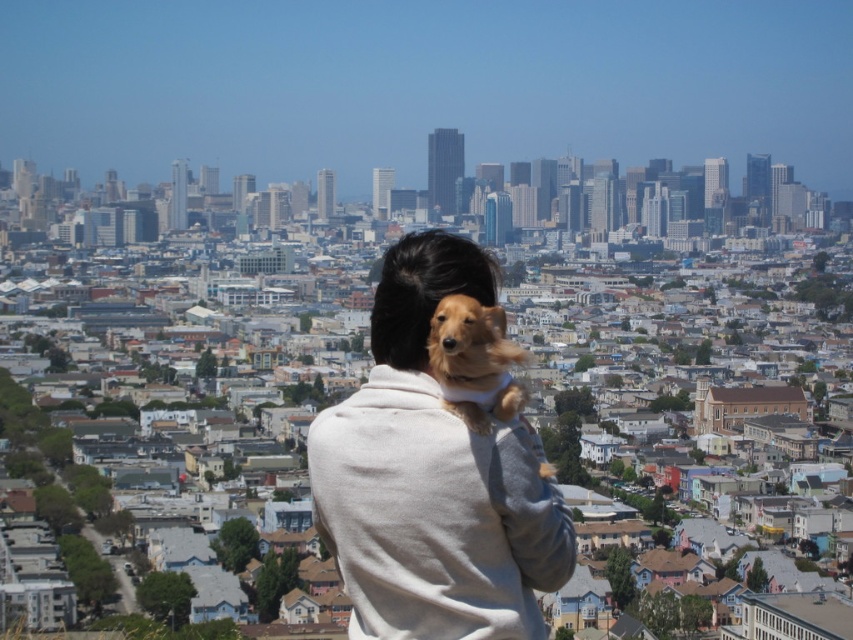
You are a photographer trying to capture the golden fur dog at upper center and the light beige sweater at center in the same frame. Which object should you adjust your camera focus to first to ensure both are in focus?

The light beige sweater at center is in front of the golden fur dog at upper center, so you should focus on the golden fur dog at upper center first to ensure both are in focus.

You are a drone operator tasked with capturing aerial footage of the light beige sweater at center. The drone is currently at the point marked by point (432, 477). To ensure the best shot, you need to adjust the drone to face directly towards the light beige sweater at center. Is the drone already facing the correct direction?

The point (432, 477) marks the light beige sweater at center, so the drone is already positioned directly at the light beige sweater at center. Therefore, it is facing the correct direction.

You are a photographer trying to capture the golden fur dog at upper center and the light beige sweater at center in the same frame. Which object should you focus on first if you want to ensure both are in focus without adjusting the camera settings?

The light beige sweater at center is larger in size than the golden fur dog at upper center, so you should focus on the light beige sweater at center first to ensure both are in focus.